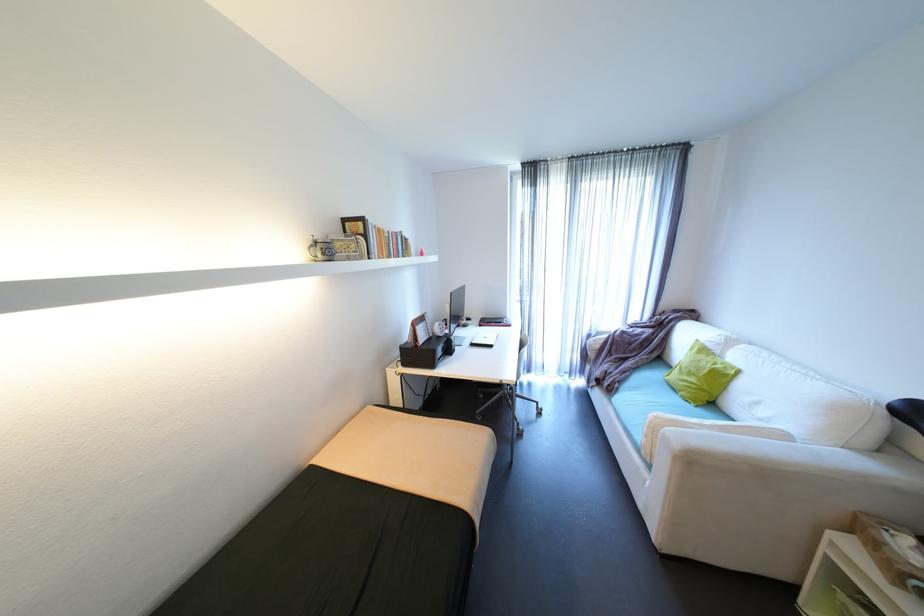
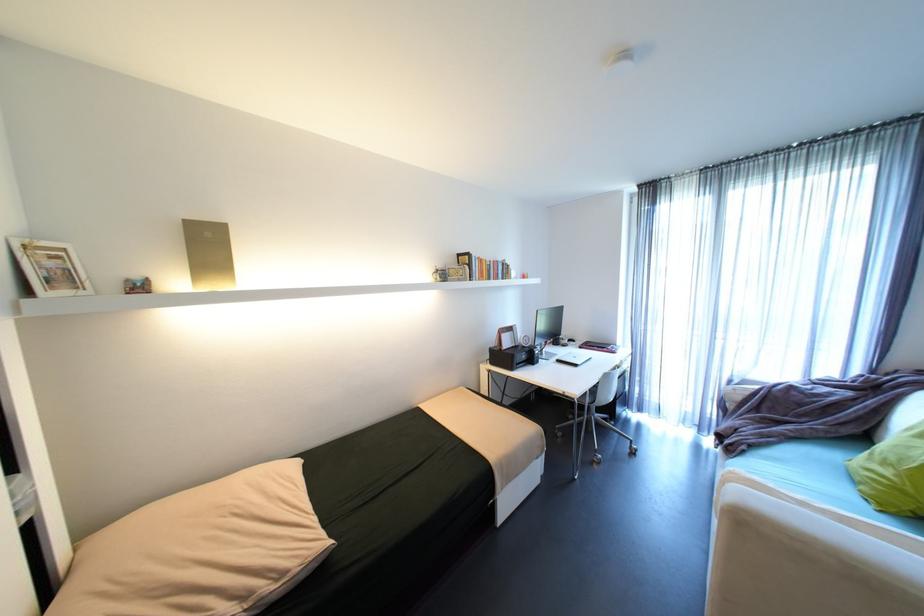
The point at (x=458, y=294) is marked in the first image. Where is the corresponding point in the second image?

(544, 310)